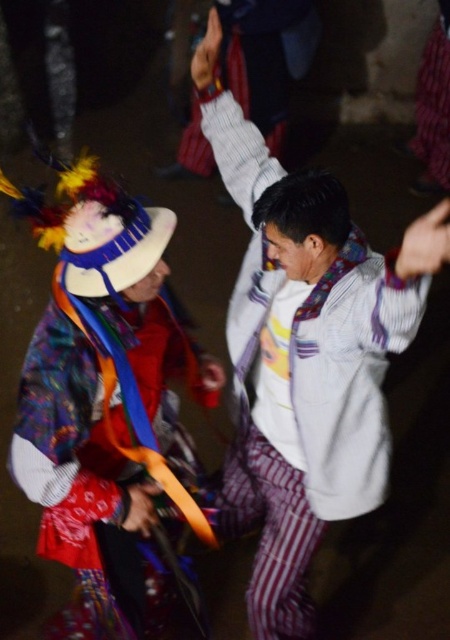
Question: Can you confirm if white striped shirt at center is wider than velvet purple scarf at upper right?

Choices:
 (A) no
 (B) yes

Answer: (B)

Question: Which object is the closest to the multicolored woven fabric at left?

Choices:
 (A) white striped shirt at center
 (B) velvet purple scarf at upper right

Answer: (A)

Question: Is white striped shirt at center thinner than velvet purple scarf at upper right?

Choices:
 (A) no
 (B) yes

Answer: (A)

Question: Which point appears closest to the camera in this image?

Choices:
 (A) (439, 84)
 (B) (343, 324)
 (C) (189, 380)

Answer: (B)

Question: Considering the relative positions of multicolored woven fabric at left and velvet purple scarf at upper right in the image provided, where is multicolored woven fabric at left located with respect to velvet purple scarf at upper right?

Choices:
 (A) left
 (B) right

Answer: (A)

Question: Which object is the closest to the velvet purple scarf at upper right?

Choices:
 (A) white striped shirt at center
 (B) multicolored woven fabric at left

Answer: (A)